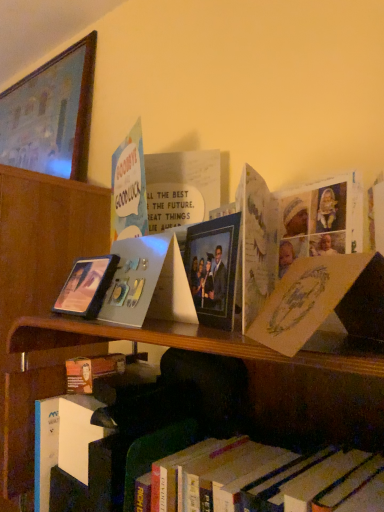
You are a GUI agent. You are given a task and a screenshot of the screen. Output one action in this format:
    pyautogui.click(x=<x>, y=<y>)
    Task: Click on the pastel paper card at upper left
    
    Given the screenshot: What is the action you would take?
    pyautogui.click(x=129, y=188)

Find the location of `matte black picture frame at left, the second picture frame when ordered from left to right`. matte black picture frame at left, the second picture frame when ordered from left to right is located at coordinates (86, 286).

Describe the element at coordinates (134, 279) in the screenshot. I see `matte silver photo album at center, which ranks as the 2th paperback book in front-to-back order` at that location.

I want to click on wooden picture frame at upper left, marked as the third picture frame in a front-to-back arrangement, so [51, 115].

Is matte silver photo album at center, the first paperback book when ordered from back to front, taller or shorter than wooden picture frame at upper left, which appears as the 1th picture frame when viewed from the left?

Clearly, matte silver photo album at center, the first paperback book when ordered from back to front, is shorter compared to wooden picture frame at upper left, which appears as the 1th picture frame when viewed from the left.

Find the location of a particular element. This screenshot has height=512, width=384. the 2nd picture frame positioned above the matte silver photo album at center, which ranks as the 2th paperback book in front-to-back order (from the image's perspective) is located at coordinates (51, 115).

Which of these two, matte silver photo album at center, which ranks as the 2th paperback book in front-to-back order, or wooden picture frame at upper left, marked as the third picture frame in a front-to-back arrangement, is bigger?

wooden picture frame at upper left, marked as the third picture frame in a front-to-back arrangement, is bigger.

From the image's perspective, is matte silver photo album at center, the first paperback book when ordered from back to front, located above or below wooden picture frame at upper left, the third picture frame in the right-to-left sequence?

Clearly, from the image's perspective, matte silver photo album at center, the first paperback book when ordered from back to front, is below wooden picture frame at upper left, the third picture frame in the right-to-left sequence.

In the scene shown: Would you say yellow paper at upper right, which is counted as the 1th paperback book, starting from the right, contains wooden picture frame at upper left, marked as the 1th picture frame in a top-to-bottom arrangement?

Actually, wooden picture frame at upper left, marked as the 1th picture frame in a top-to-bottom arrangement, is outside yellow paper at upper right, which is counted as the 1th paperback book, starting from the right.

Between yellow paper at upper right, which is counted as the 1th paperback book, starting from the right, and wooden picture frame at upper left, which ranks as the 1th picture frame in back-to-front order, which one has smaller width?

With smaller width is wooden picture frame at upper left, which ranks as the 1th picture frame in back-to-front order.

Would you say yellow paper at upper right, which is counted as the 1th paperback book, starting from the right, is a long distance from wooden picture frame at upper left, which is the 3th picture frame in bottom-to-top order?

Yes, yellow paper at upper right, which is counted as the 1th paperback book, starting from the right, is far from wooden picture frame at upper left, which is the 3th picture frame in bottom-to-top order.

Between yellow paper at upper right, arranged as the 2th paperback book when viewed from the left, and wooden picture frame at upper left, which ranks as the 1th picture frame in back-to-front order, which one has more height?

Standing taller between the two is wooden picture frame at upper left, which ranks as the 1th picture frame in back-to-front order.

Consider the image. From a real-world perspective, is yellow paper at upper right, the second paperback book in the back-to-front sequence, physically located above or below pastel paper card at upper left?

Clearly, from a real-world perspective, yellow paper at upper right, the second paperback book in the back-to-front sequence, is below pastel paper card at upper left.

How different are the orientations of yellow paper at upper right, which is counted as the 1th paperback book, starting from the right, and pastel paper card at upper left in degrees?

15 degrees.

From the image's perspective, is yellow paper at upper right, the second paperback book in the back-to-front sequence, over pastel paper card at upper left?

No.

Measure the distance from yellow paper at upper right, placed as the 1th paperback book when sorted from front to back, to pastel paper card at upper left.

The distance of yellow paper at upper right, placed as the 1th paperback book when sorted from front to back, from pastel paper card at upper left is 15.90 inches.

Considering the positions of objects pastel paper card at upper left and matte black picture frame at left, arranged as the 2th picture frame when viewed from the front, in the image provided, who is more to the left, pastel paper card at upper left or matte black picture frame at left, arranged as the 2th picture frame when viewed from the front,?

matte black picture frame at left, arranged as the 2th picture frame when viewed from the front.

Is point (122, 219) more distant than point (87, 307)?

Yes.

How different are the orientations of pastel paper card at upper left and matte black picture frame at left, the 3th picture frame positioned from the top, in degrees?

pastel paper card at upper left and matte black picture frame at left, the 3th picture frame positioned from the top, are facing 14 degrees away from each other.

Which is in front, pastel paper card at upper left or matte black picture frame at left, which is the second picture frame from back to front?

matte black picture frame at left, which is the second picture frame from back to front, is in front.

Based on the photo, is matte silver photo album at center, which ranks as the 2th paperback book in front-to-back order, turned away from yellow paper at upper right, arranged as the 2th paperback book when viewed from the left?

matte silver photo album at center, which ranks as the 2th paperback book in front-to-back order, does not have its back to yellow paper at upper right, arranged as the 2th paperback book when viewed from the left.

From the picture: From a real-world perspective, does matte silver photo album at center, the first paperback book when ordered from back to front, stand above yellow paper at upper right, arranged as the 2th paperback book when viewed from the left?

Correct, in the physical world, matte silver photo album at center, the first paperback book when ordered from back to front, is higher than yellow paper at upper right, arranged as the 2th paperback book when viewed from the left.

Between matte silver photo album at center, which is counted as the first paperback book, starting from the left, and yellow paper at upper right, placed as the 1th paperback book when sorted from front to back, which one has smaller width?

Thinner between the two is matte silver photo album at center, which is counted as the first paperback book, starting from the left.

Does point (134, 308) appear closer or farther from the camera than point (377, 334)?

Point (134, 308) appears to be farther away from the viewer than point (377, 334).

From the image's perspective, which object appears higher, matte black picture frame at left, positioned as the 2th picture frame in right-to-left order, or yellow paper at upper right, which is counted as the 1th paperback book, starting from the right?

yellow paper at upper right, which is counted as the 1th paperback book, starting from the right.

How different are the orientations of matte black picture frame at left, the 3th picture frame positioned from the top, and yellow paper at upper right, which is counted as the 1th paperback book, starting from the right, in degrees?

The facing directions of matte black picture frame at left, the 3th picture frame positioned from the top, and yellow paper at upper right, which is counted as the 1th paperback book, starting from the right, are 29 degrees apart.

Based on the photo, from a real-world perspective, between matte black picture frame at left, the 3th picture frame positioned from the top, and yellow paper at upper right, the second paperback book in the back-to-front sequence, who is vertically higher?

matte black picture frame at left, the 3th picture frame positioned from the top, from a real-world perspective.

Is matte black picture frame at left, the second picture frame when ordered from left to right, with yellow paper at upper right, placed as the 1th paperback book when sorted from front to back?

matte black picture frame at left, the second picture frame when ordered from left to right, and yellow paper at upper right, placed as the 1th paperback book when sorted from front to back, are not in contact.

At what (x,y) coordinates should I click in order to perform the action: click on the 2nd picture frame in front of the pastel paper card at upper left, counting from the anchor's position. Please return your answer as a coordinate pair (x, y). This screenshot has height=512, width=384. Looking at the image, I should click on (213, 269).

Does matte plastic picture frame at center, the third picture frame viewed from the back, have a larger size compared to pastel paper card at upper left?

No, matte plastic picture frame at center, the third picture frame viewed from the back, is not bigger than pastel paper card at upper left.

Locate an element on the screen. The height and width of the screenshot is (512, 384). the 2nd picture frame directly above the matte silver photo album at center, the first paperback book when ordered from back to front (from a real-world perspective) is located at coordinates (51, 115).

Where is `the 2nd paperback book directly beneath the wooden picture frame at upper left, which is the 3th picture frame in bottom-to-top order (from a real-world perspective)`? The width and height of the screenshot is (384, 512). the 2nd paperback book directly beneath the wooden picture frame at upper left, which is the 3th picture frame in bottom-to-top order (from a real-world perspective) is located at coordinates (323, 302).

Consider the image. Considering their positions, is wooden picture frame at upper left, marked as the third picture frame in a front-to-back arrangement, positioned further to matte plastic picture frame at center, the second picture frame in the bottom-to-top sequence, than pastel paper card at upper left?

wooden picture frame at upper left, marked as the third picture frame in a front-to-back arrangement, is positioned further to the anchor matte plastic picture frame at center, the second picture frame in the bottom-to-top sequence.

Based on the photo, from the image, which object appears to be nearer to wooden picture frame at upper left, which appears as the 1th picture frame when viewed from the left, matte plastic picture frame at center, arranged as the third picture frame when viewed from the left, or pastel paper card at upper left?

Based on the image, pastel paper card at upper left appears to be nearer to wooden picture frame at upper left, which appears as the 1th picture frame when viewed from the left.

Estimate the real-world distances between objects in this image. Which object is closer to matte silver photo album at center, which ranks as the 2th paperback book in front-to-back order, pastel paper card at upper left or matte black picture frame at left, positioned as the 2th picture frame in right-to-left order?

matte black picture frame at left, positioned as the 2th picture frame in right-to-left order, is positioned closer to the anchor matte silver photo album at center, which ranks as the 2th paperback book in front-to-back order.

Looking at the image, which one is located further to matte silver photo album at center, which ranks as the 2th paperback book in front-to-back order, wooden picture frame at upper left, the third picture frame in the right-to-left sequence, or yellow paper at upper right, arranged as the 2th paperback book when viewed from the left?

wooden picture frame at upper left, the third picture frame in the right-to-left sequence, lies further to matte silver photo album at center, which ranks as the 2th paperback book in front-to-back order, than the other object.

When comparing their distances from matte silver photo album at center, the first paperback book when ordered from back to front, does yellow paper at upper right, which is counted as the 1th paperback book, starting from the right, or wooden picture frame at upper left, which ranks as the 1th picture frame in back-to-front order, seem further?

wooden picture frame at upper left, which ranks as the 1th picture frame in back-to-front order, is further to matte silver photo album at center, the first paperback book when ordered from back to front.

Consider the image. Considering their positions, is matte black picture frame at left, which is the second picture frame from back to front, positioned further to matte silver photo album at center, which is counted as the first paperback book, starting from the left, than wooden picture frame at upper left, the third picture frame in the right-to-left sequence?

wooden picture frame at upper left, the third picture frame in the right-to-left sequence.

Based on their spatial positions, is matte silver photo album at center, which is counted as the first paperback book, starting from the left, or matte black picture frame at left, acting as the 1th picture frame starting from the bottom, closer to wooden picture frame at upper left, the third picture frame in the right-to-left sequence?

matte black picture frame at left, acting as the 1th picture frame starting from the bottom, lies closer to wooden picture frame at upper left, the third picture frame in the right-to-left sequence, than the other object.

From the image, which object appears to be nearer to matte black picture frame at left, arranged as the 2th picture frame when viewed from the front, pastel paper card at upper left or wooden picture frame at upper left, the third picture frame in the right-to-left sequence?

pastel paper card at upper left is closer to matte black picture frame at left, arranged as the 2th picture frame when viewed from the front.

This screenshot has width=384, height=512. Find the location of `paperback book between yellow paper at upper right, which is counted as the 1th paperback book, starting from the right, and matte black picture frame at left, positioned as the 2th picture frame in right-to-left order, in the front-back direction`. paperback book between yellow paper at upper right, which is counted as the 1th paperback book, starting from the right, and matte black picture frame at left, positioned as the 2th picture frame in right-to-left order, in the front-back direction is located at coordinates (134, 279).

In order to click on paperback book between yellow paper at upper right, arranged as the 2th paperback book when viewed from the left, and wooden picture frame at upper left, which ranks as the 1th picture frame in back-to-front order, in the front-back direction in this screenshot , I will do `click(134, 279)`.

You are a GUI agent. You are given a task and a screenshot of the screen. Output one action in this format:
    pyautogui.click(x=<x>, y=<y>)
    Task: Click on the book between matte silver photo album at center, which is counted as the first paperback book, starting from the left, and wooden picture frame at upper left, marked as the 1th picture frame in a top-to-bottom arrangement, from front to back
    The width and height of the screenshot is (384, 512).
    Given the screenshot: What is the action you would take?
    pyautogui.click(x=129, y=188)

The height and width of the screenshot is (512, 384). Find the location of `book situated between matte black picture frame at left, the second picture frame when ordered from left to right, and matte plastic picture frame at center, the 1th picture frame from the front, from left to right`. book situated between matte black picture frame at left, the second picture frame when ordered from left to right, and matte plastic picture frame at center, the 1th picture frame from the front, from left to right is located at coordinates (129, 188).